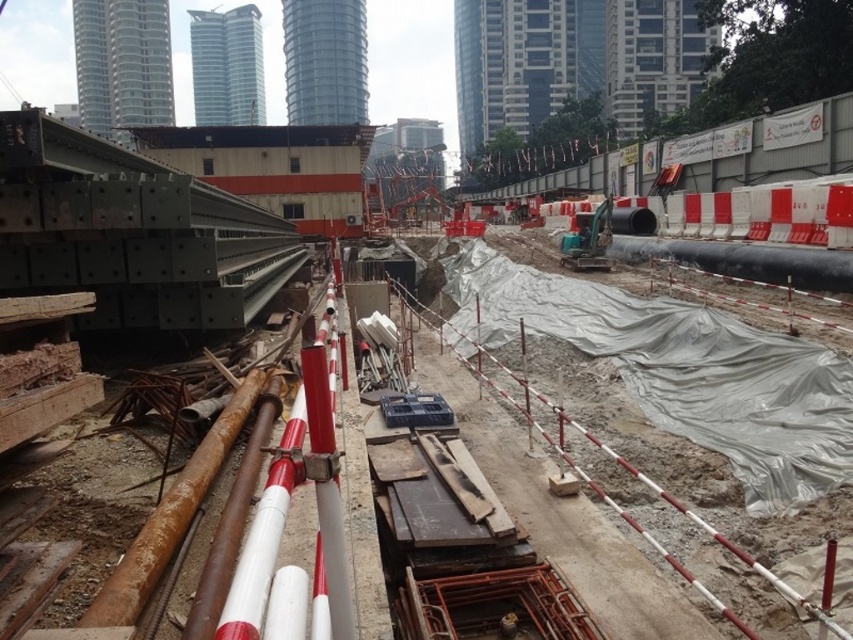
Question: Is gray tarpaulin at center smaller than red fabric construction worker at center?

Choices:
 (A) yes
 (B) no

Answer: (B)

Question: Where is gray tarpaulin at center located in relation to red fabric construction worker at center in the image?

Choices:
 (A) below
 (B) above

Answer: (B)

Question: Which of the following is the farthest from the observer?

Choices:
 (A) gray tarpaulin at center
 (B) red fabric construction worker at center

Answer: (B)

Question: Which point appears farthest from the camera in this image?

Choices:
 (A) (357, 349)
 (B) (503, 388)

Answer: (A)

Question: Which object appears closest to the camera in this image?

Choices:
 (A) red fabric construction worker at center
 (B) gray tarpaulin at center

Answer: (B)

Question: Observing the image, what is the correct spatial positioning of gray tarpaulin at center in reference to red fabric construction worker at center?

Choices:
 (A) below
 (B) above

Answer: (B)